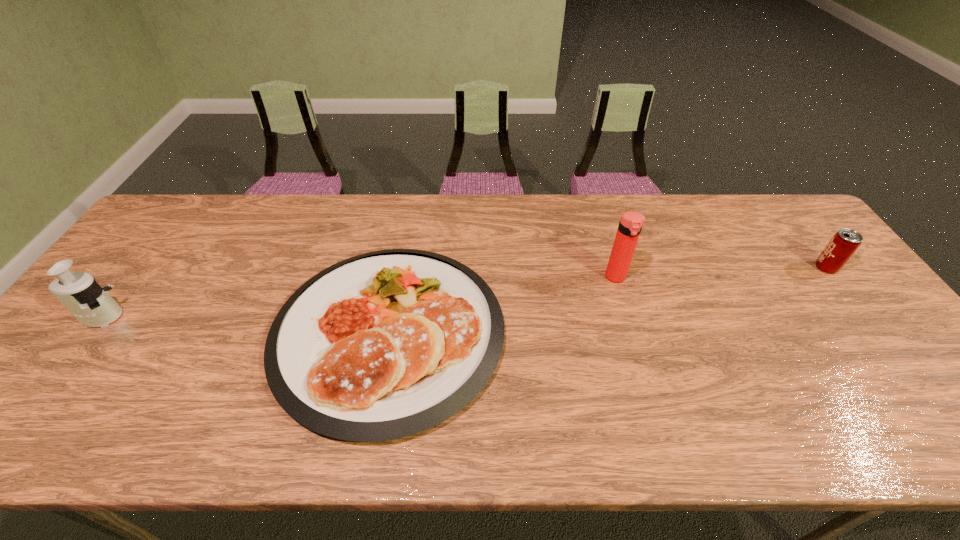
Locate an element on the screen. free location that satisfies the following two spatial constraints: 1. on the back side of the shortest object; 2. on the left side of the tallest object is located at coordinates (398, 278).

Identify the location of free space that satisfies the following two spatial constraints: 1. on the back side of the second shortest object; 2. on the left side of the second object from right to left. (612, 268).